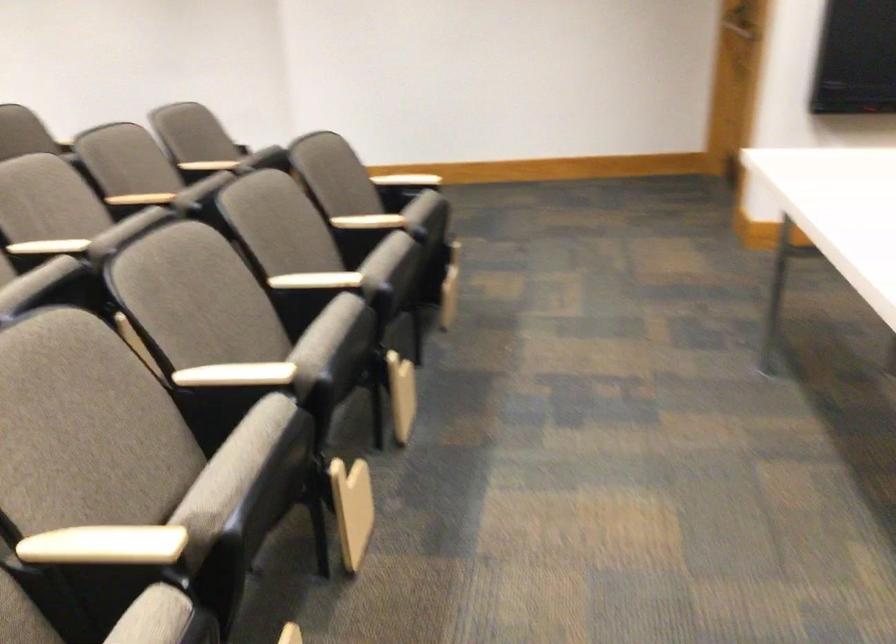
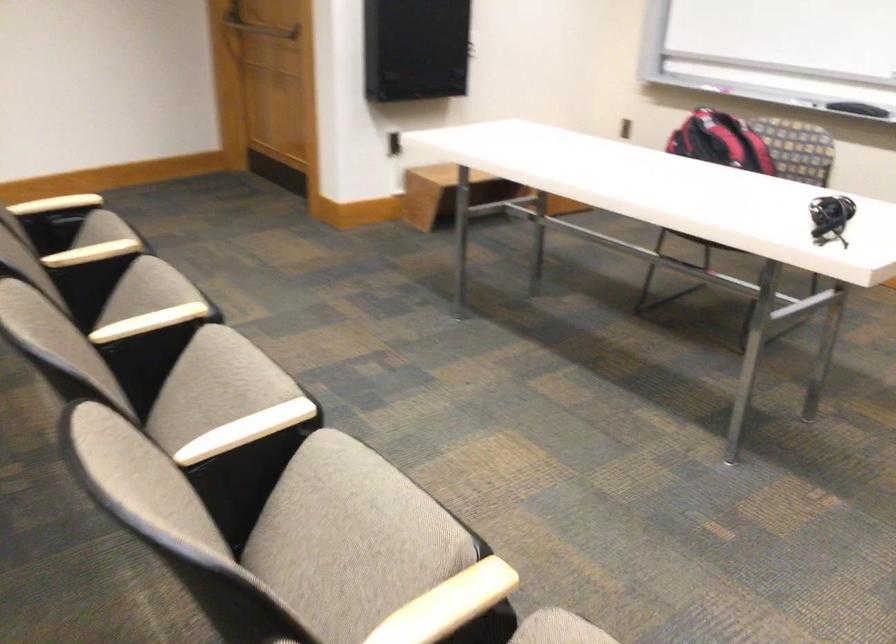
Where in the second image is the point corresponding to (x=371, y=252) from the first image?

(147, 290)